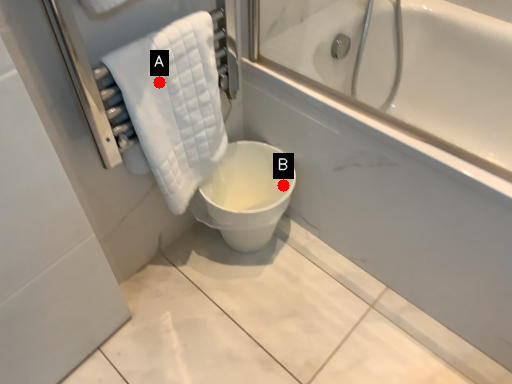
Question: Two points are circled on the image, labeled by A and B beside each circle. Which point is farther to the camera?

Choices:
 (A) A is further
 (B) B is further

Answer: (B)